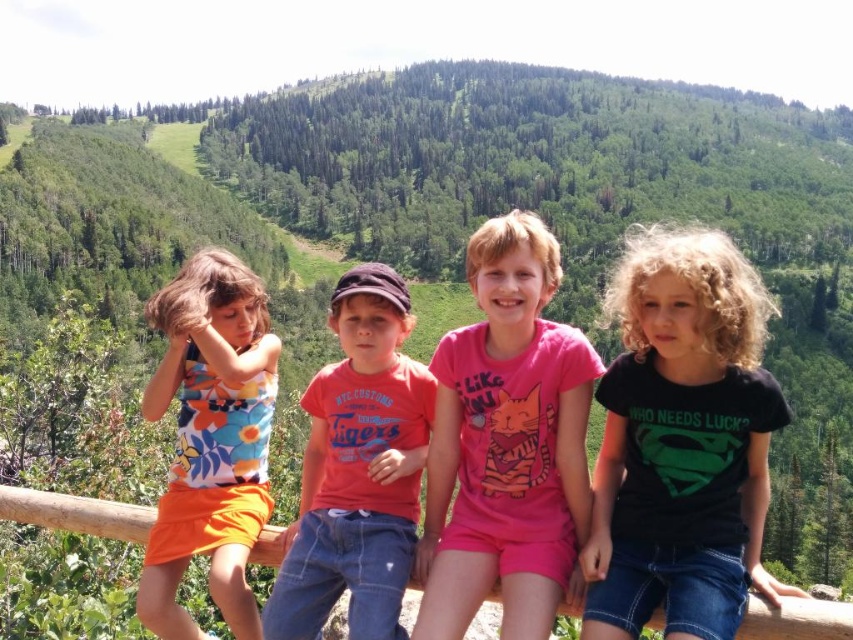
You are a photographer trying to capture a photo of the children on the wooden railing. You want to ensure both the black cotton shirt at center and the pink cotton shirt at center are clearly visible in the frame. Which child should you focus on to ensure the taller one is in focus?

The black cotton shirt at center is taller than the pink cotton shirt at center, so focusing on the child wearing the black cotton shirt at center will ensure the taller one is in focus.